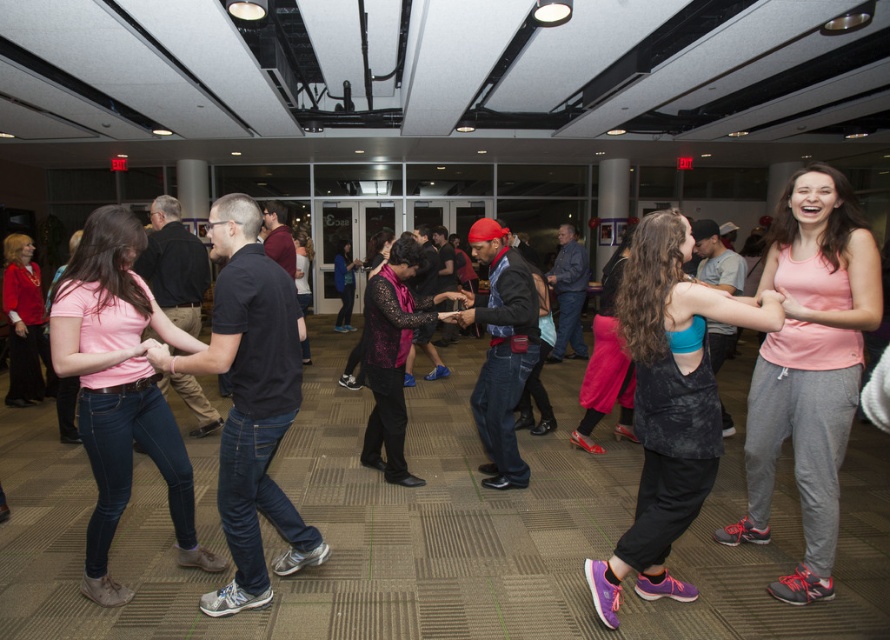
Question: Considering the relative positions of pink tank top at center and pink matte t-shirt at center in the image provided, where is pink tank top at center located with respect to pink matte t-shirt at center?

Choices:
 (A) right
 (B) left

Answer: (A)

Question: Can you confirm if matte black tank top at center is positioned below pink matte t-shirt at center?

Choices:
 (A) no
 (B) yes

Answer: (B)

Question: Based on their relative distances, which object is farther from the matte red blouse at left?

Choices:
 (A) matte black tank top at center
 (B) pink tank top at center
 (C) black lace dress at center

Answer: (B)

Question: Estimate the real-world distances between objects in this image. Which object is closer to the pink matte t-shirt at center?

Choices:
 (A) black lace dress at center
 (B) matte black tank top at center
 (C) pink fabric dress at center
 (D) pink tank top at center

Answer: (A)

Question: Which of these objects is positioned farthest from the matte black tank top at center?

Choices:
 (A) pink matte t-shirt at center
 (B) pink fabric dress at center
 (C) matte red blouse at left

Answer: (C)

Question: Is black lace dress at center above pink fabric dress at center?

Choices:
 (A) no
 (B) yes

Answer: (A)